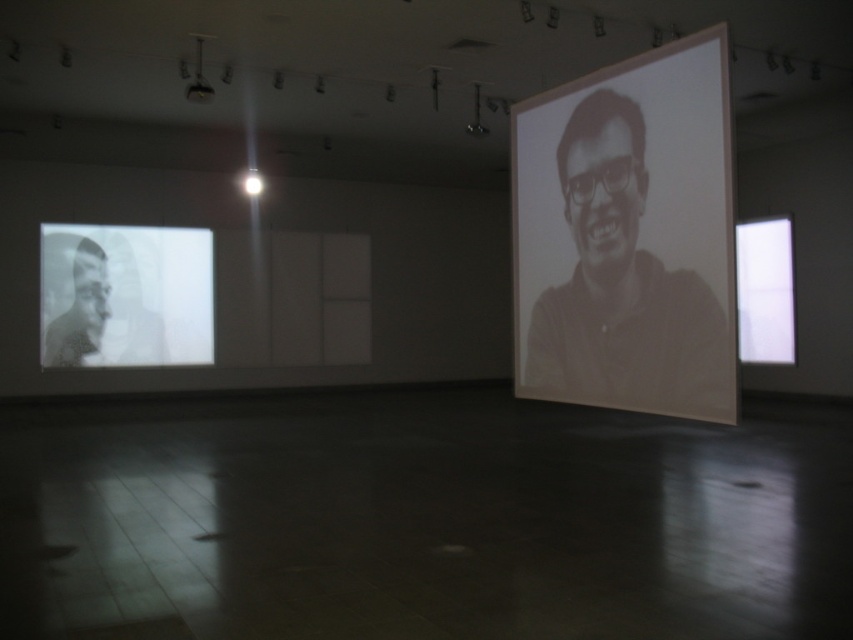
You are an art critic standing in the gallery. You notice the gray matte portrait at center and the metallic projector at upper center. Which object is positioned closer to your current viewpoint?

The gray matte portrait at center is closer to the viewer than the metallic projector at upper center.

You are standing in the art gallery and notice two points in the image. The first point is at coordinates point (630, 388) and the second is at point (111, 349). Which point appears closer to you?

Point (630, 388) is closer to the camera than point (111, 349), so the first point appears closer to you.

Looking at this image, you are an art curator planning to install a new spotlight. You see the gray matte portrait at center and the white matte projection screen at left. Which object is positioned lower in the scene?

The gray matte portrait at center is located below the white matte projection screen at left, so it is positioned lower in the scene.